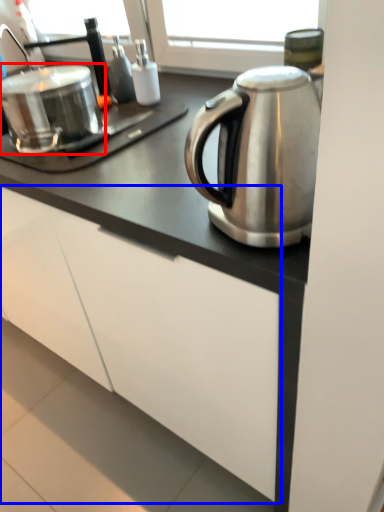
Question: Which object appears closest to the camera in this image, appliance (highlighted by a red box) or cabinetry (highlighted by a blue box)?

Choices:
 (A) appliance
 (B) cabinetry

Answer: (B)